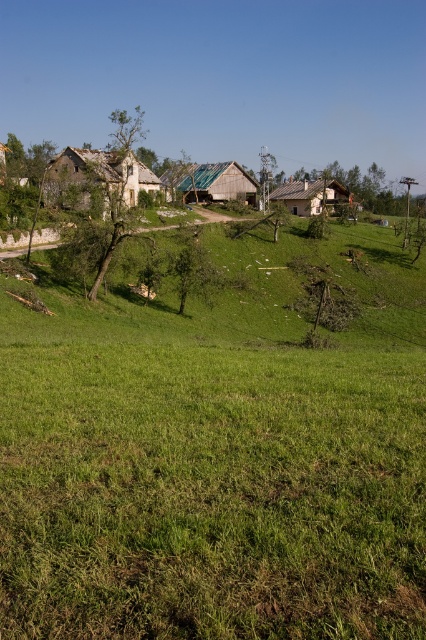
You are standing at the origin point in the rural landscape. There is a rustic wooden hut at center left. Can you see the point at coordinates (97, 179) from your current position?

Yes, the point at coordinates (97, 179) corresponds to the rustic wooden hut at center left, so you can see it from your current position.